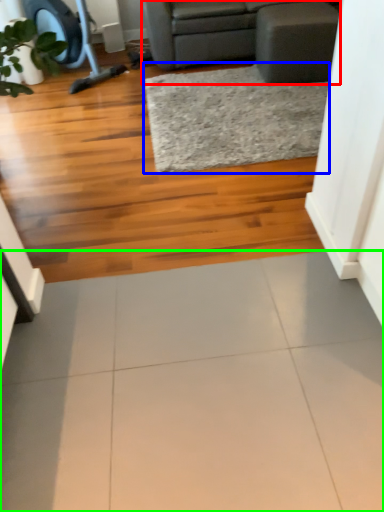
Question: Which object is positioned farthest from studio couch (highlighted by a red box)? Select from mat (highlighted by a blue box) and ceramic tile (highlighted by a green box).

Choices:
 (A) mat
 (B) ceramic tile

Answer: (B)